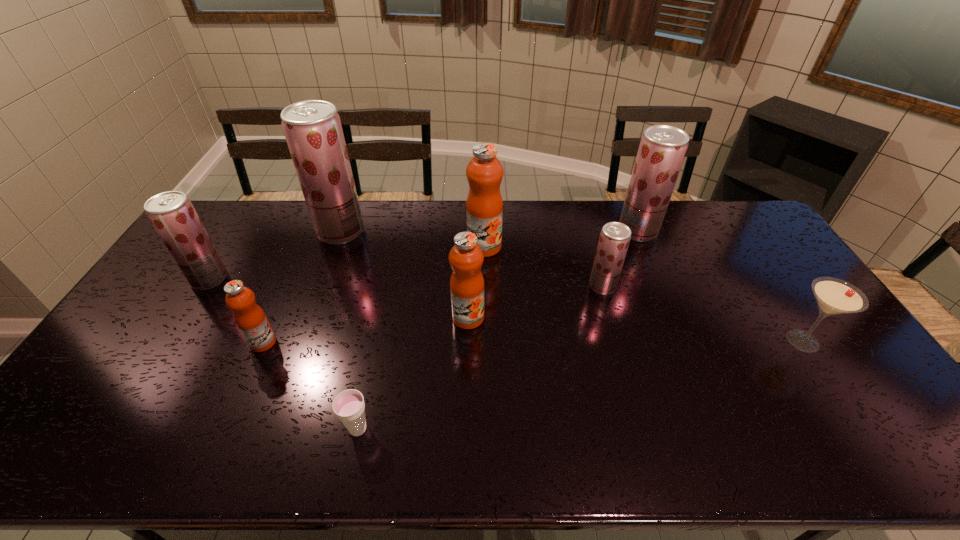
The width and height of the screenshot is (960, 540). I want to click on empty space between the leftmost fruit juice and the second biggest orange fruit juice, so click(339, 298).

Locate an element on the screen. The image size is (960, 540). free space between the third biggest strawberry fruit juice and the second smallest orange fruit juice is located at coordinates (339, 298).

The height and width of the screenshot is (540, 960). In order to click on object that ranks as the eighth closest to the biggest strawberry fruit juice in this screenshot , I will do `click(834, 296)`.

This screenshot has height=540, width=960. In order to click on the third closest object to the third object from right to left in this screenshot , I will do `click(466, 258)`.

Image resolution: width=960 pixels, height=540 pixels. In order to click on fruit juice that can be found as the fourth closest to the leftmost object in this screenshot , I will do `click(484, 207)`.

Identify the location of fruit juice that stands as the seventh closest to the martini. The image size is (960, 540). (171, 213).

Where is `the closest strawberry fruit juice to the farthest orange fruit juice`? the closest strawberry fruit juice to the farthest orange fruit juice is located at coordinates (614, 240).

Identify the location of strawberry fruit juice that is the third closest to the second smallest orange fruit juice. (662, 149).

This screenshot has height=540, width=960. I want to click on orange fruit juice that stands as the closest to the sixth farthest fruit juice, so click(x=484, y=207).

Choose which orange fruit juice is the nearest neighbor to the smallest orange fruit juice. Please provide its 2D coordinates. Your answer should be formatted as a tuple, i.e. [(x, y)], where the tuple contains the x and y coordinates of a point satisfying the conditions above.

[(466, 258)]